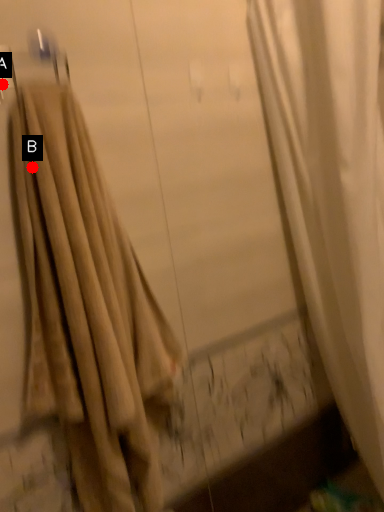
Question: Two points are circled on the image, labeled by A and B beside each circle. Which point is closer to the camera?

Choices:
 (A) A is closer
 (B) B is closer

Answer: (B)